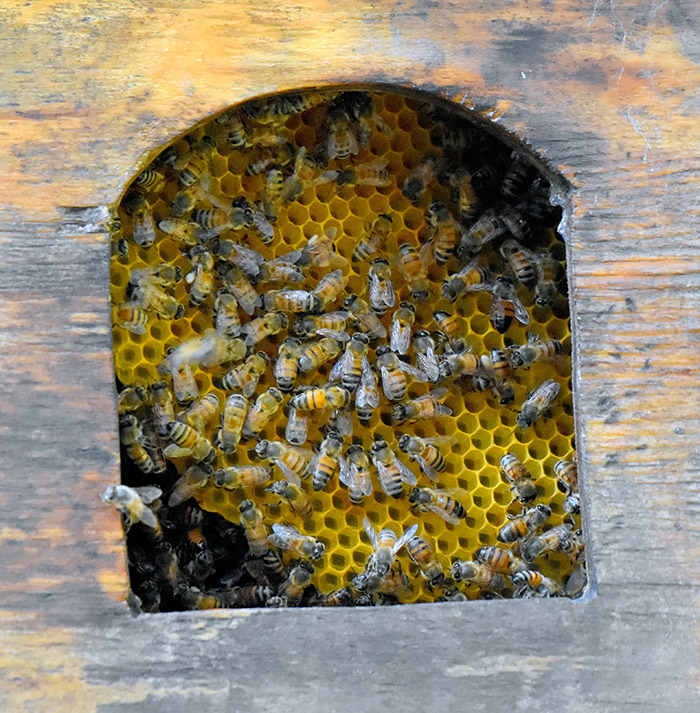
Where is `door`? This screenshot has height=713, width=700. door is located at coordinates (297, 105).